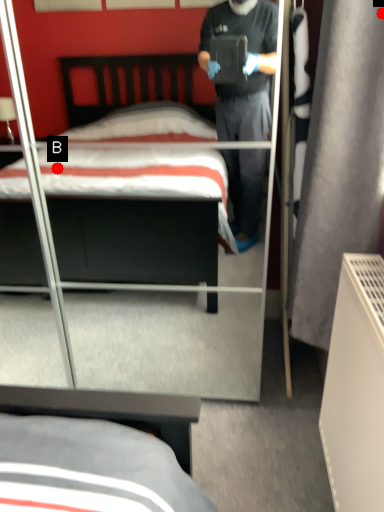
Question: Two points are circled on the image, labeled by A and B beside each circle. Which point is farther to the camera?

Choices:
 (A) A is further
 (B) B is further

Answer: (B)